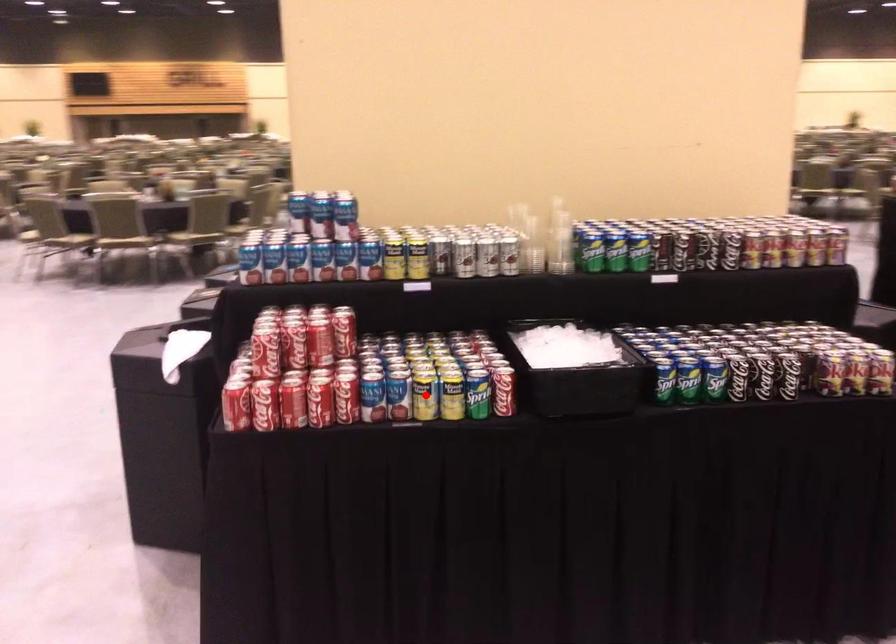
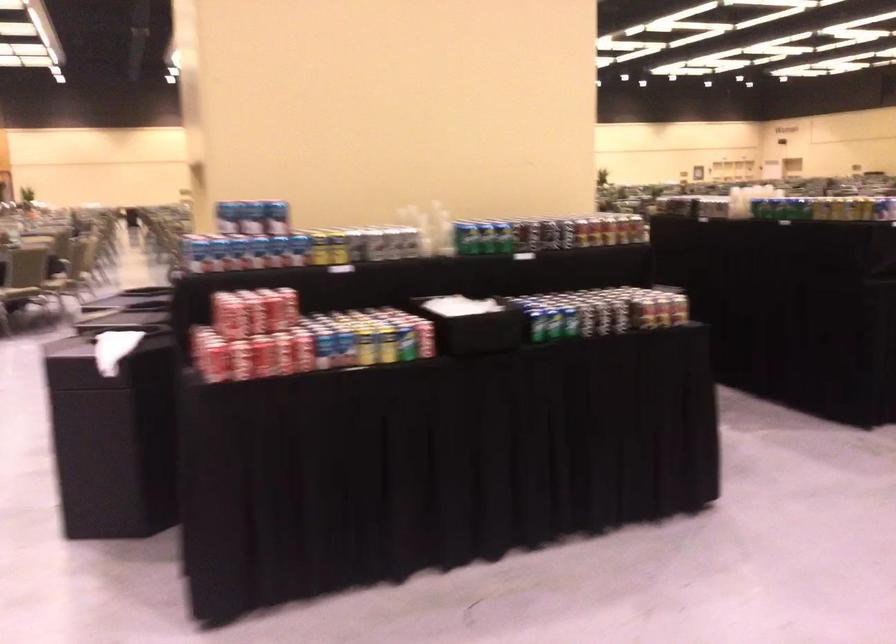
Where in the second image is the point corresponding to the highlighted location from the first image?

(365, 346)